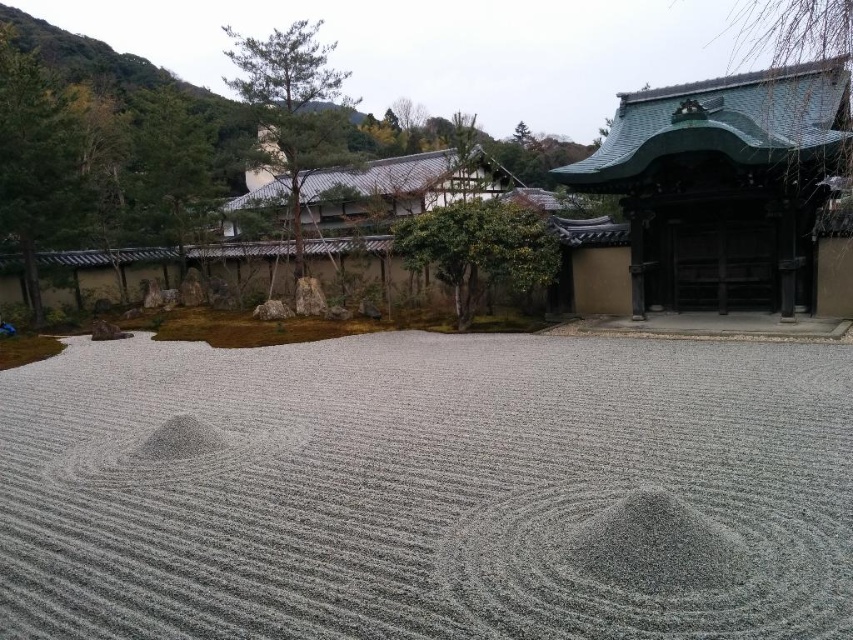
Can you confirm if gray gravel at center is thinner than green tiled roof at upper right?

No.

Does point (473, 605) come in front of point (677, 218)?

Yes, it is.

Where is `gray gravel at center`? This screenshot has width=853, height=640. gray gravel at center is located at coordinates (427, 490).